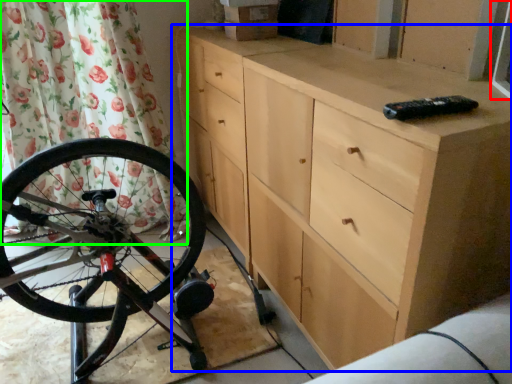
Question: Which is nearer to the window screen (highlighted by a red box)? chest of drawers (highlighted by a blue box) or shower curtain (highlighted by a green box).

Choices:
 (A) chest of drawers
 (B) shower curtain

Answer: (A)